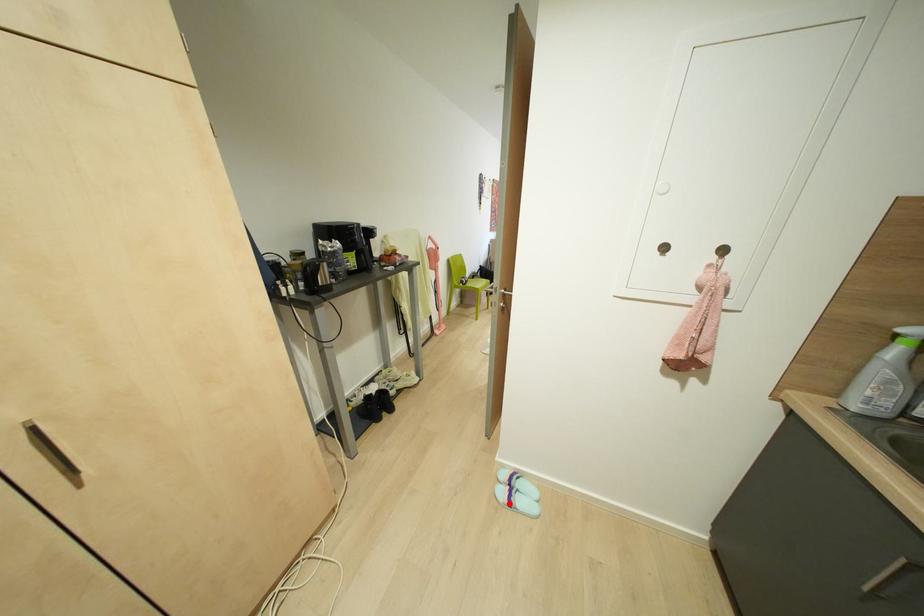
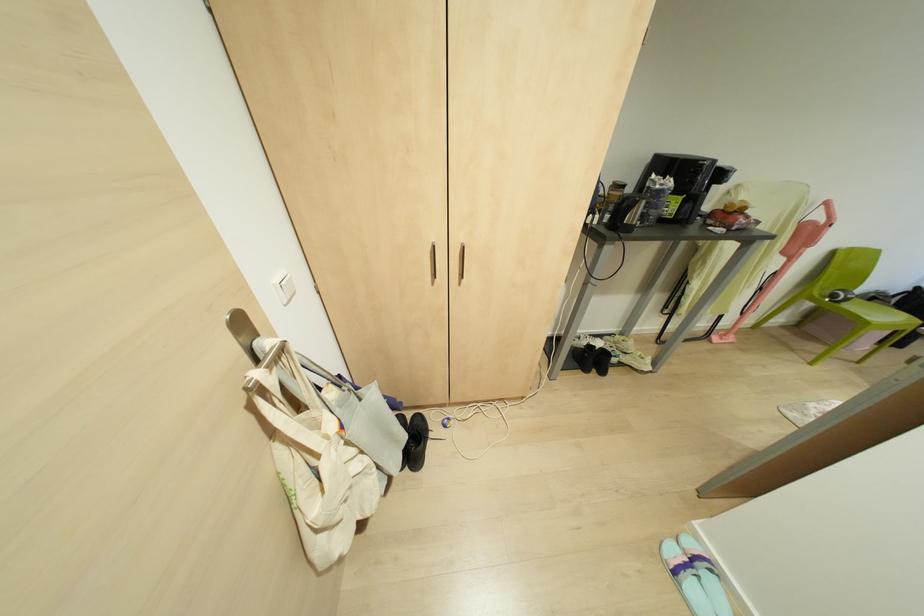
The point at the highlighted location is marked in the first image. Where is the corresponding point in the second image?

(675, 572)